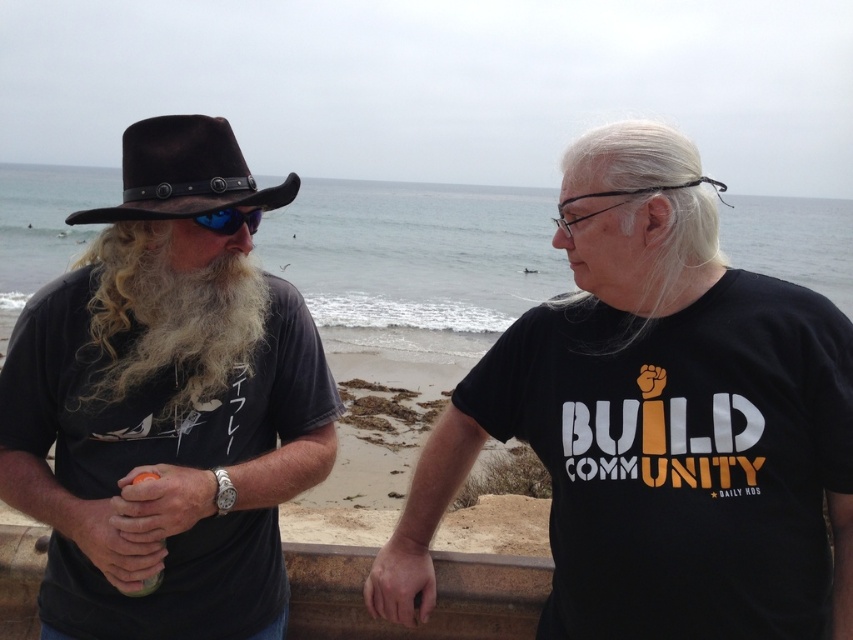
Question: Among these points, which one is farthest from the camera?

Choices:
 (A) [155, 369]
 (B) [209, 193]
 (C) [814, 616]

Answer: (A)

Question: Observing the image, what is the correct spatial positioning of black matte t-shirt at right in reference to blue reflective lens at center?

Choices:
 (A) below
 (B) above

Answer: (A)

Question: Which point appears closest to the camera in this image?

Choices:
 (A) (122, 136)
 (B) (701, 627)
 (C) (252, 221)
 (D) (164, 516)

Answer: (D)

Question: Is matte black cowboy hat at left in front of black matte t-shirt at right?

Choices:
 (A) no
 (B) yes

Answer: (B)

Question: Estimate the real-world distances between objects in this image. Which object is closer to the black matte t-shirt at right?

Choices:
 (A) brown leather cowboy hat at upper left
 (B) curly blonde hair at left
 (C) blue reflective lens at center

Answer: (B)

Question: In this image, where is brown leather cowboy hat at upper left located relative to blue reflective lens at center?

Choices:
 (A) below
 (B) above

Answer: (B)